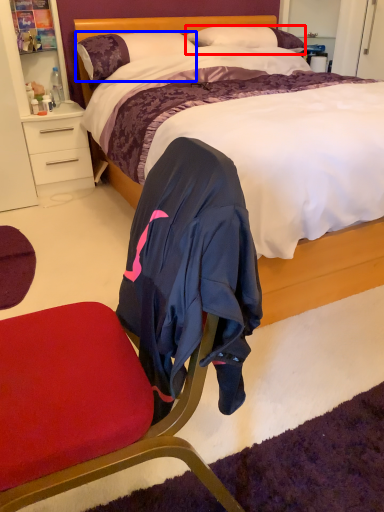
Question: Which object appears closest to the camera in this image, pillow (highlighted by a red box) or pillow (highlighted by a blue box)?

Choices:
 (A) pillow
 (B) pillow

Answer: (B)